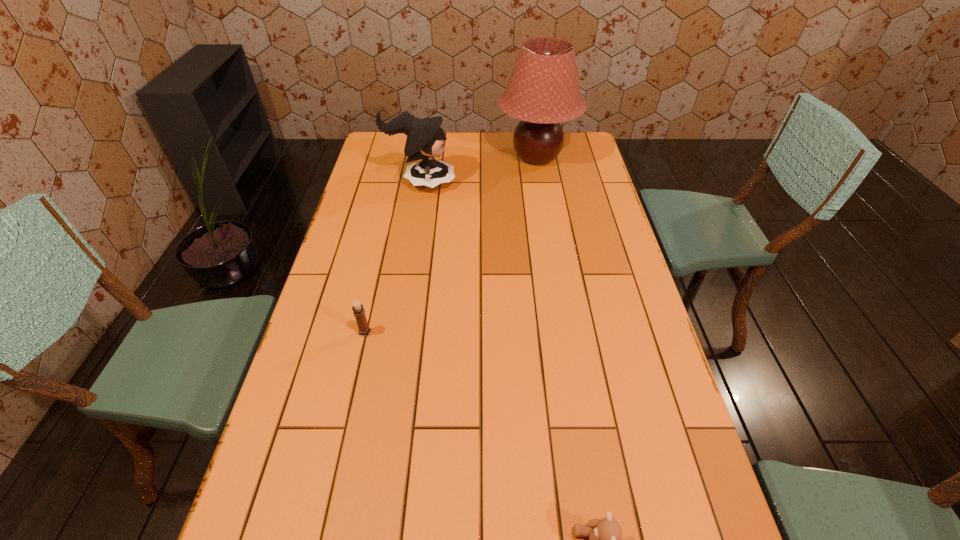
Where is `vacant area that lies between the tallest object and the third shortest object`? vacant area that lies between the tallest object and the third shortest object is located at coordinates (479, 170).

Where is `unoccupied position between the candle holder and the doll`? The width and height of the screenshot is (960, 540). unoccupied position between the candle holder and the doll is located at coordinates 393,258.

Find the location of a particular element. free point between the second shortest object and the tallest object is located at coordinates 451,245.

Where is `object identified as the third closest to the second nearest object`? object identified as the third closest to the second nearest object is located at coordinates (543, 90).

The image size is (960, 540). In order to click on the third closest object to the third shortest object in this screenshot , I will do `click(605, 534)`.

Where is `vacant point that satisfies the following two spatial constraints: 1. on the front-facing side of the lampshade; 2. on the front side of the second shortest object`? vacant point that satisfies the following two spatial constraints: 1. on the front-facing side of the lampshade; 2. on the front side of the second shortest object is located at coordinates (566, 333).

The width and height of the screenshot is (960, 540). In order to click on vacant region that satisfies the following two spatial constraints: 1. at the face of the doll; 2. on the front side of the candle holder in this screenshot , I will do `click(396, 333)`.